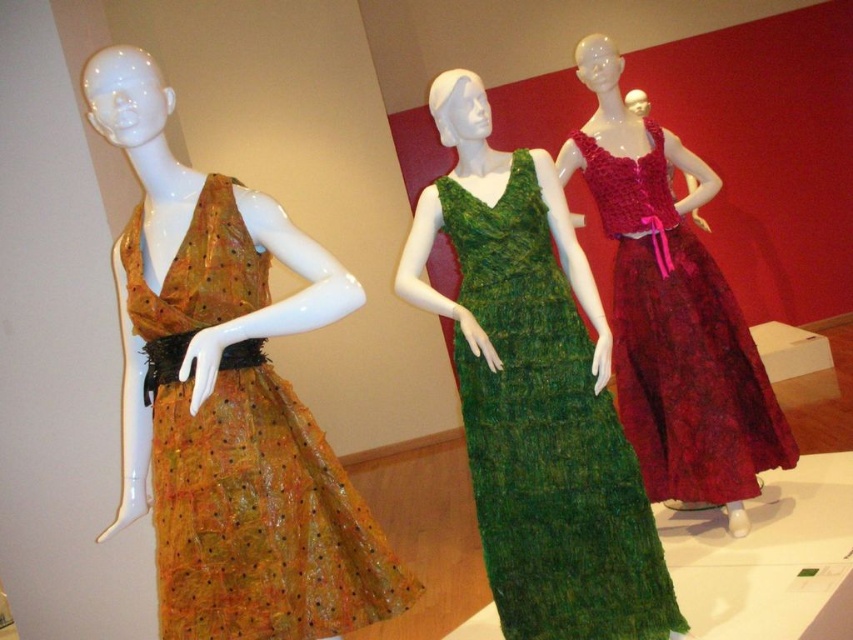
Question: Can you confirm if translucent orange dress at left is smaller than green knitted dress at center?

Choices:
 (A) yes
 (B) no

Answer: (A)

Question: Which object is farther from the camera taking this photo?

Choices:
 (A) velvet-like burgundy dress at right
 (B) translucent orange dress at left
 (C) green knitted dress at center

Answer: (A)

Question: Can you confirm if translucent orange dress at left is thinner than green knitted dress at center?

Choices:
 (A) yes
 (B) no

Answer: (B)

Question: Which point appears closest to the camera in this image?

Choices:
 (A) (135, 333)
 (B) (619, 337)
 (C) (561, 388)

Answer: (A)

Question: Which is farther from the translucent orange dress at left?

Choices:
 (A) green knitted dress at center
 (B) velvet-like burgundy dress at right

Answer: (B)

Question: Does translucent orange dress at left lie behind velvet-like burgundy dress at right?

Choices:
 (A) no
 (B) yes

Answer: (A)